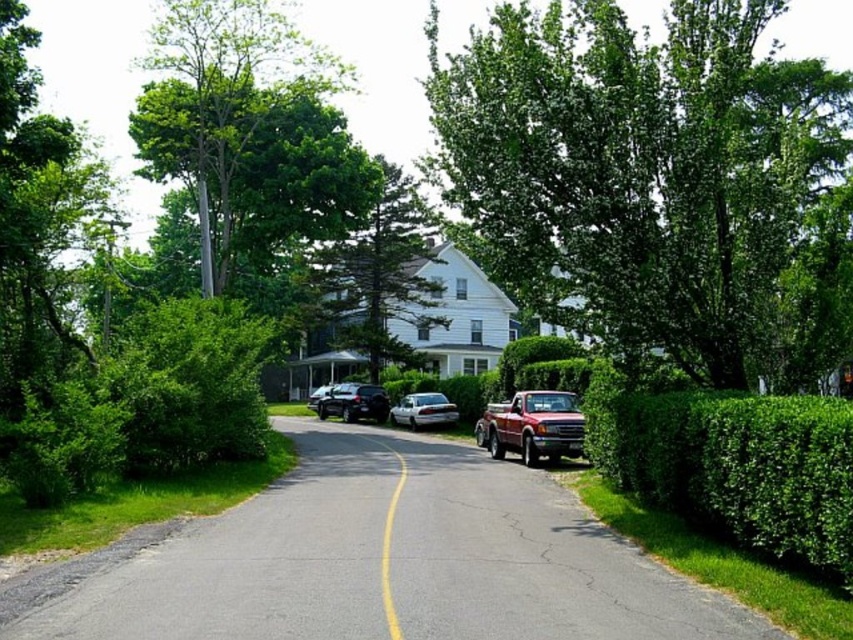
You are a delivery drone flying above the suburban street scene. You need to deliver a package to the red pickup truck parked on the right side of the road. There is a green leafy tree at upper left in the image. To avoid the tree, should you approach the red pickup truck from the left or the right side of the road?

The green leafy tree at upper left is located at coordinates (248, 129). Since the tree is positioned at the upper left of the image, approaching the red pickup truck on the right side of the road from the right side would keep you away from the tree. Therefore, you should approach from the right side of the road to avoid the tree.

You are a delivery driver who needs to park your vehicle between the green leafy tree at upper left and the white glossy sedan at center. Considering their sizes, which object should you position your vehicle closer to for better visibility?

The green leafy tree at upper left has a larger size compared to the white glossy sedan at center. Therefore, positioning your vehicle closer to the smaller white glossy sedan at center would provide better visibility as it takes up less space.

You are a delivery person trying to park your vehicle in this suburban street scene. You see the green leafy tree at upper left and the shiny silver sedan at center. Which object is taller, and would that affect your parking decision?

The green leafy tree at upper left is taller than the shiny silver sedan at center. This might affect your parking decision as the tree could block sunlight or obstruct visibility, so you should consider parking where the shiny silver sedan at center is located for better visibility and sunlight access.